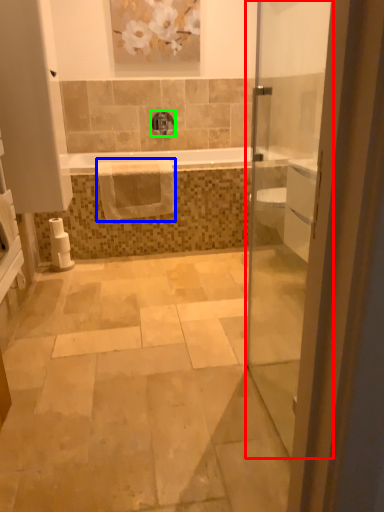
Question: Estimate the real-world distances between objects in this image. Which object is closer to door (highlighted by a red box), hand towel (highlighted by a blue box) or tap (highlighted by a green box)?

Choices:
 (A) hand towel
 (B) tap

Answer: (B)